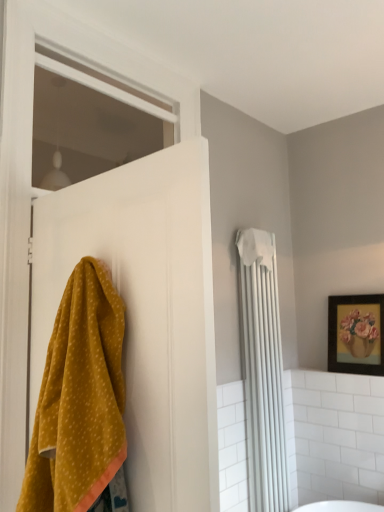
Question: Is white fabric towel at upper right located within wooden framed painting at upper right?

Choices:
 (A) yes
 (B) no

Answer: (B)

Question: From the image's perspective, would you say wooden framed painting at upper right is shown under white fabric towel at upper right?

Choices:
 (A) yes
 (B) no

Answer: (B)

Question: Does wooden framed painting at upper right have a greater height compared to white fabric towel at upper right?

Choices:
 (A) no
 (B) yes

Answer: (A)

Question: Is wooden framed painting at upper right far from white fabric towel at upper right?

Choices:
 (A) no
 (B) yes

Answer: (A)

Question: Is wooden framed painting at upper right facing away from white fabric towel at upper right?

Choices:
 (A) no
 (B) yes

Answer: (A)

Question: In the image, is mustard yellow towel at left positioned in front of or behind white matte window at upper left?

Choices:
 (A) front
 (B) behind

Answer: (A)

Question: Considering the positions of mustard yellow towel at left and white matte window at upper left in the image, is mustard yellow towel at left wider or thinner than white matte window at upper left?

Choices:
 (A) wide
 (B) thin

Answer: (A)

Question: From the image's perspective, is mustard yellow towel at left above or below white matte window at upper left?

Choices:
 (A) below
 (B) above

Answer: (A)

Question: Based on their sizes in the image, would you say mustard yellow towel at left is bigger or smaller than white matte window at upper left?

Choices:
 (A) small
 (B) big

Answer: (B)

Question: Considering the positions of yellow fabric at left and white matte window at upper left in the image, is yellow fabric at left taller or shorter than white matte window at upper left?

Choices:
 (A) tall
 (B) short

Answer: (A)

Question: From the image's perspective, is yellow fabric at left above or below white matte window at upper left?

Choices:
 (A) below
 (B) above

Answer: (A)

Question: Relative to white matte window at upper left, is yellow fabric at left in front or behind?

Choices:
 (A) front
 (B) behind

Answer: (A)

Question: Based on their sizes in the image, would you say yellow fabric at left is bigger or smaller than white matte window at upper left?

Choices:
 (A) small
 (B) big

Answer: (B)

Question: Is yellow fabric at left to the left or to the right of wooden framed painting at upper right in the image?

Choices:
 (A) right
 (B) left

Answer: (B)

Question: Is yellow fabric at left taller or shorter than wooden framed painting at upper right?

Choices:
 (A) tall
 (B) short

Answer: (A)